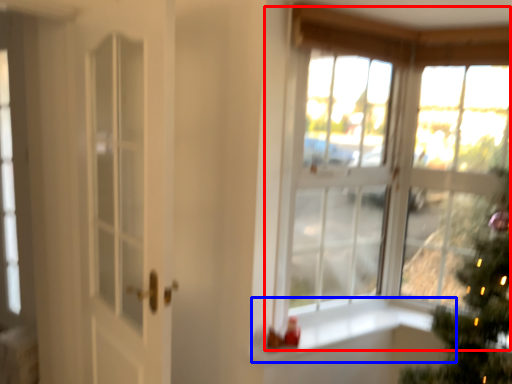
Question: Which point is further to the camera, window (highlighted by a red box) or window sill (highlighted by a blue box)?

Choices:
 (A) window
 (B) window sill

Answer: (B)